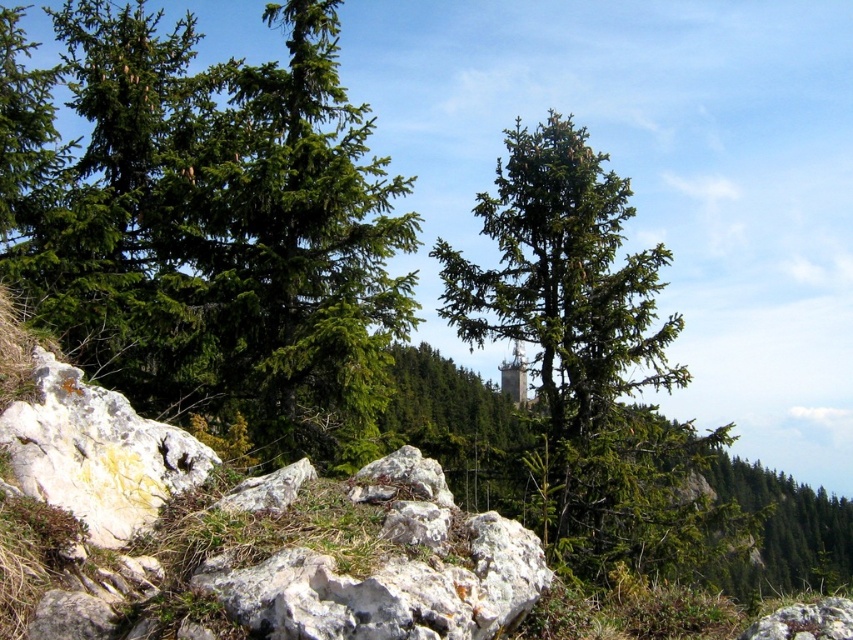
Is green matte tree at left above green matte tree at center?

Correct, green matte tree at left is located above green matte tree at center.

Does point (236, 339) lie in front of point (488, 317)?

Yes, it is.

Which is in front, point (352, 413) or point (531, 259)?

Point (352, 413) is more forward.

Locate an element on the screen. green matte tree at left is located at coordinates (222, 232).